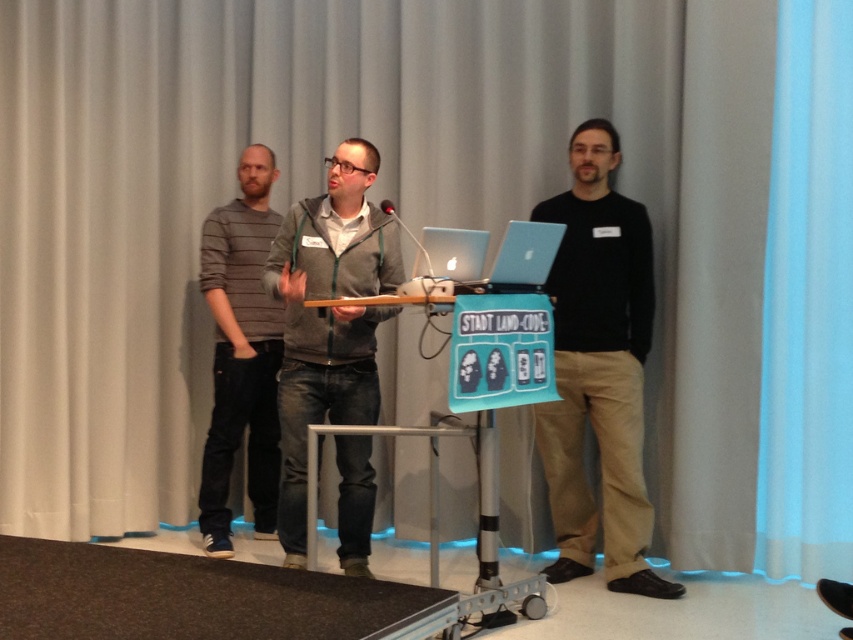
You are attending a presentation and notice two items in the foreground. Which item is closer to you between the jeans at center and the striped sweater at left?

The jeans at center is closer to you because it is in front of the striped sweater at left.

You are standing in front of the podium at the event and notice an object labeled jeans at center. Based on its coordinates, can you determine if it is placed directly in the center of the image?

The jeans at center is located at coordinates point (328, 317), which is very close to the center of the image. Therefore, it can be considered as being placed directly in the center.